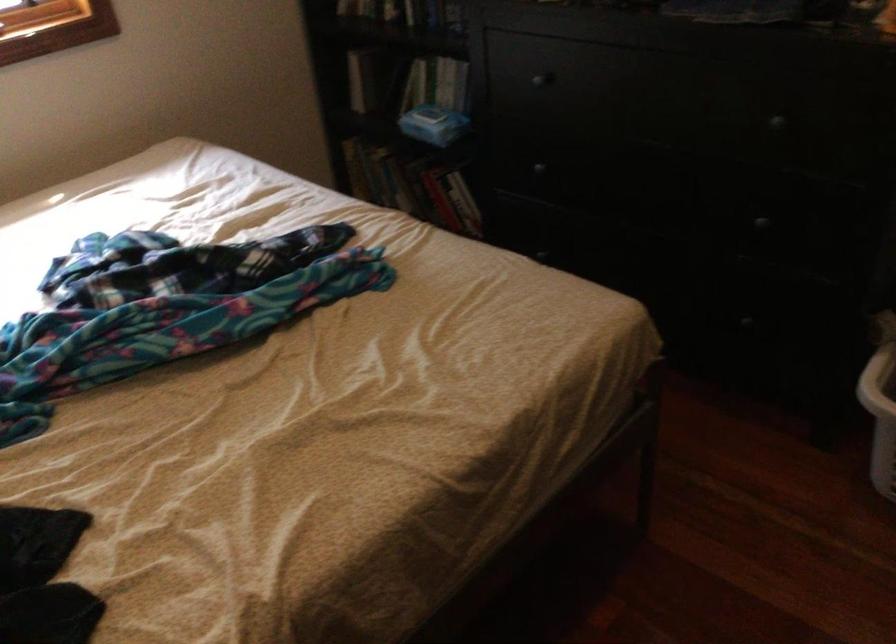
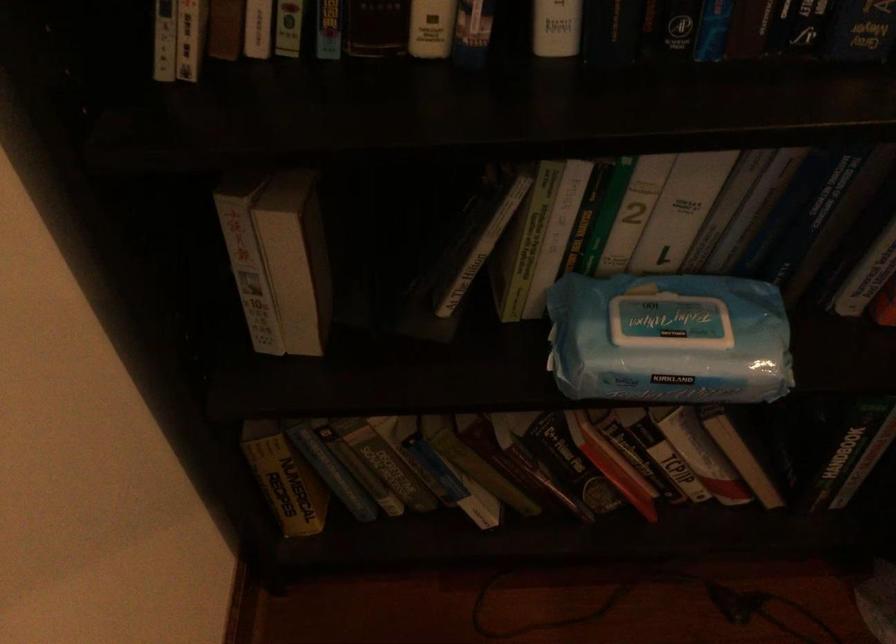
In the second image, find the point that corresponds to (x=348, y=163) in the first image.

(285, 478)